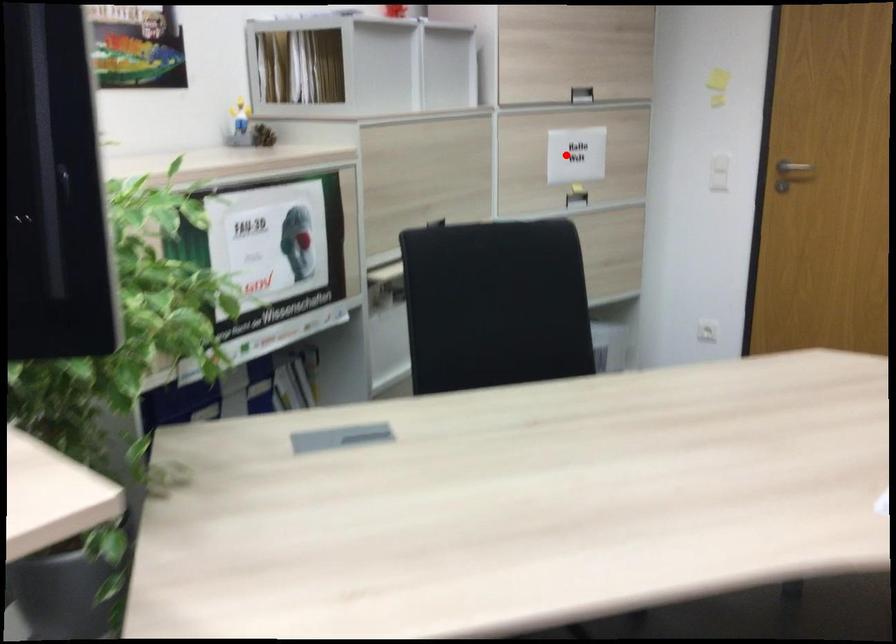
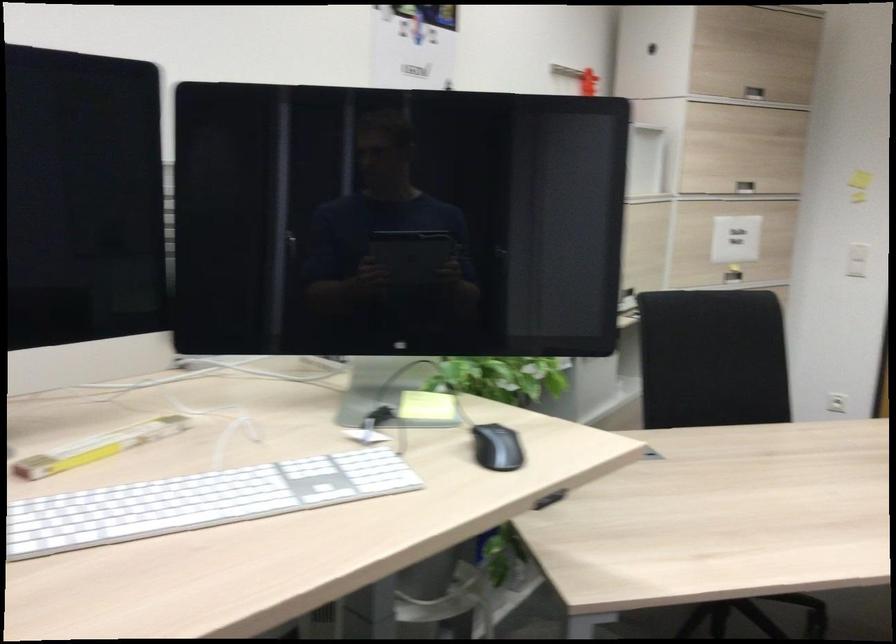
Find the pixel in the second image that matches the highlighted location in the first image.

(736, 239)